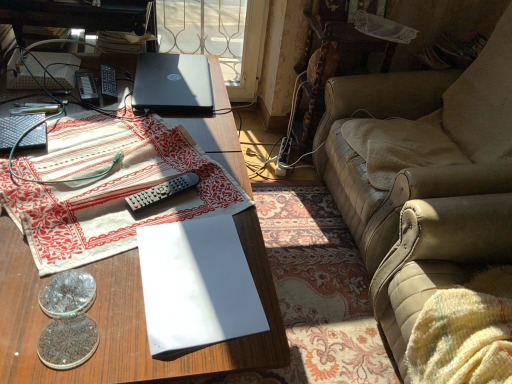
The image size is (512, 384). What are the coordinates of `free space that is in between satin black laptop at upper center and shiny metallic coin at lower left, placed as the 1th coin when sorted from back to front` in the screenshot? It's located at (132, 166).